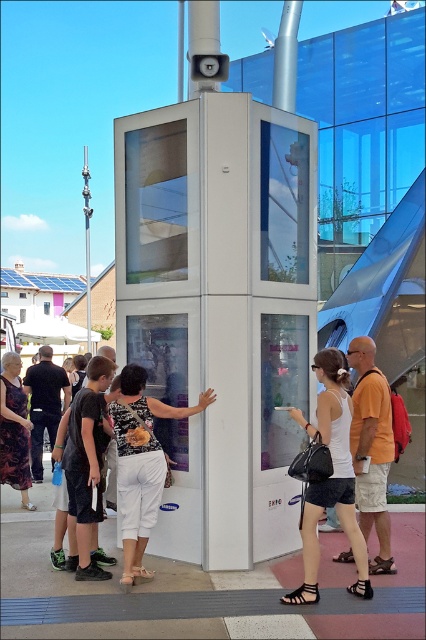
You are a delivery person who needs to place a printed fabric blouse at center into a box that can only fit items smaller than the white glossy phone box at center. Based on the scene, will the blouse fit?

The white glossy phone box at center is larger in size than the printed fabric blouse at center, so the blouse will fit into the box since it is smaller than the phone box.